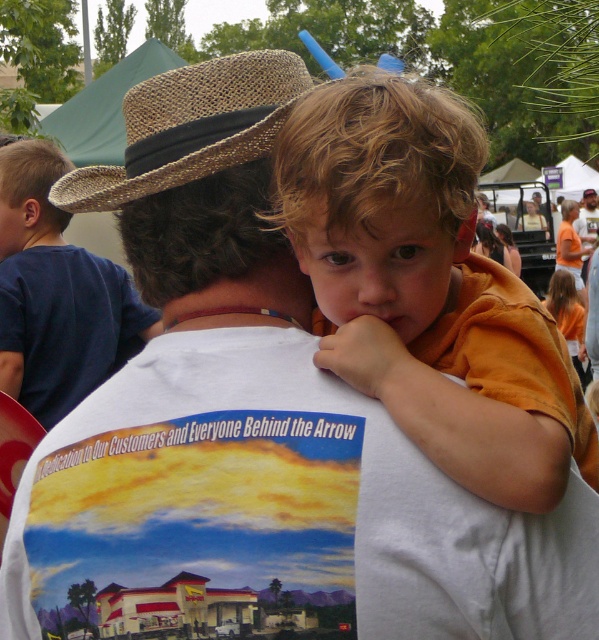
Is orange cotton shirt at upper center to the left of brown woven cowboy hat at upper center from the viewer's perspective?

In fact, orange cotton shirt at upper center is to the right of brown woven cowboy hat at upper center.

Can you confirm if orange cotton shirt at upper center is positioned above brown woven cowboy hat at upper center?

Incorrect, orange cotton shirt at upper center is not positioned above brown woven cowboy hat at upper center.

Which is in front, point (294, 120) or point (252, 150)?

Point (294, 120)

Find the location of a particular element. The width and height of the screenshot is (599, 640). orange cotton shirt at upper center is located at coordinates (426, 289).

Is orange cotton shirt at upper center closer to camera compared to blue cotton shirt at upper center?

Yes, it is in front of blue cotton shirt at upper center.

What are the coordinates of `orange cotton shirt at upper center` in the screenshot? It's located at (426, 289).

The height and width of the screenshot is (640, 599). I want to click on orange cotton shirt at upper center, so click(426, 289).

Does blue cotton shirt at upper center appear on the left side of brown woven cowboy hat at upper center?

Correct, you'll find blue cotton shirt at upper center to the left of brown woven cowboy hat at upper center.

Between point (23, 212) and point (225, 104), which one is positioned in front?

Point (225, 104) is in front.

Locate an element on the screen. Image resolution: width=599 pixels, height=640 pixels. blue cotton shirt at upper center is located at coordinates (55, 292).